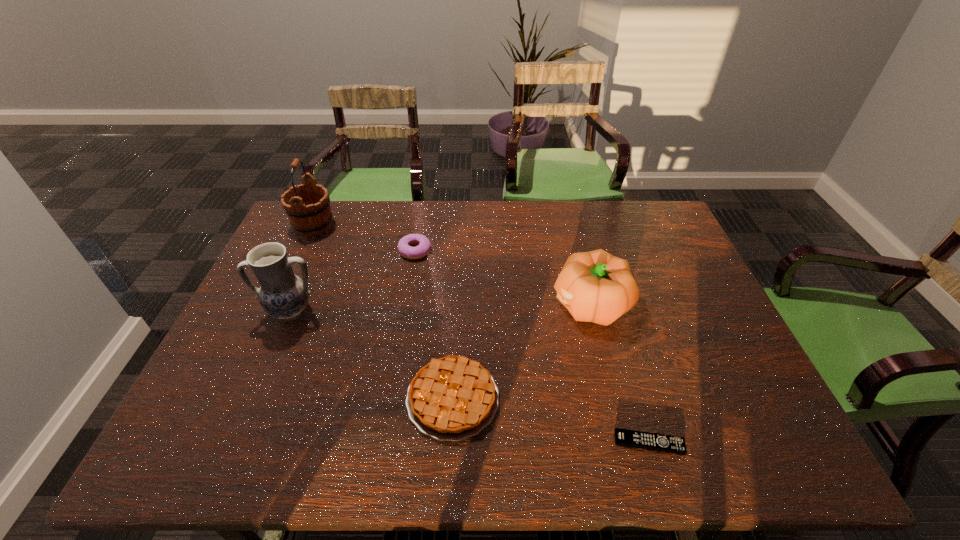
Locate an element on the screen. vacant space in between the doughnut and the second tallest object is located at coordinates (353, 281).

Image resolution: width=960 pixels, height=540 pixels. In order to click on free space between the doughnut and the pottery in this screenshot , I will do `click(353, 281)`.

Where is `unoccupied area between the remote control and the pie`? This screenshot has height=540, width=960. unoccupied area between the remote control and the pie is located at coordinates (551, 421).

What are the coordinates of `vacant point located between the pie and the remote control` in the screenshot? It's located at (551, 421).

Image resolution: width=960 pixels, height=540 pixels. Find the location of `vacant region between the wine bucket and the doughnut`. vacant region between the wine bucket and the doughnut is located at coordinates (365, 239).

Locate an element on the screen. the fifth closest object to the fifth shortest object is located at coordinates (623, 437).

This screenshot has height=540, width=960. Identify the location of the closest object relative to the wine bucket. (424, 245).

You are a GUI agent. You are given a task and a screenshot of the screen. Output one action in this format:
    pyautogui.click(x=<x>, y=<y>)
    Task: Click on the free space that satisfies the following two spatial constraints: 1. on the back side of the remote control; 2. on the carved face of the third tallest object
    
    Given the screenshot: What is the action you would take?
    pyautogui.click(x=609, y=304)

Find the location of a particular element. vacant space that satisfies the following two spatial constraints: 1. on the front side of the wine bucket; 2. on the right side of the fifth shortest object is located at coordinates (275, 312).

Find the location of a particular element. free spot that satisfies the following two spatial constraints: 1. on the back side of the doughnut; 2. on the left side of the fifth shortest object is located at coordinates (317, 251).